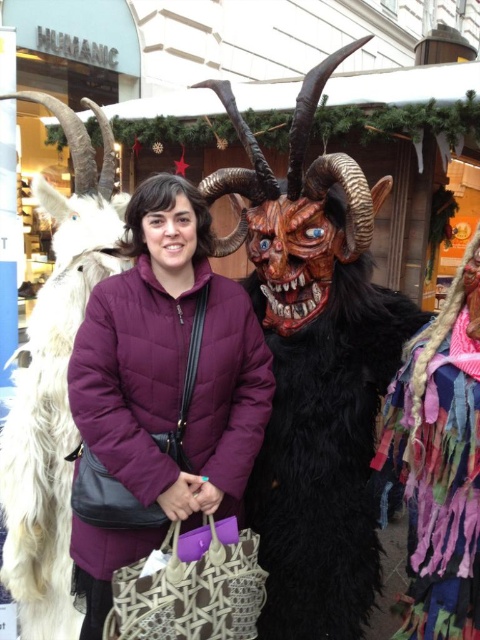
Is point (352, 372) positioned behind point (204, 292)?

Yes, point (352, 372) is behind point (204, 292).

Where is `wooden carved mask at center`? Image resolution: width=480 pixels, height=640 pixels. wooden carved mask at center is located at coordinates (314, 369).

Does point (372, 200) come farther from viewer compared to point (96, 224)?

No, it is in front of (96, 224).

Is the position of wooden carved mask at center more distant than that of white fur goat at left?

No, wooden carved mask at center is in front of white fur goat at left.

Does point (276, 486) come in front of point (20, 572)?

No, it is not.

The width and height of the screenshot is (480, 640). I want to click on wooden carved mask at center, so click(314, 369).

Can you confirm if purple quilted jacket at center is thinner than white fur goat at left?

No.

Who is higher up, purple quilted jacket at center or white fur goat at left?

white fur goat at left is higher up.

You are a GUI agent. You are given a task and a screenshot of the screen. Output one action in this format:
    pyautogui.click(x=<x>, y=<y>)
    Task: Click on the purple quilted jacket at center
    
    Given the screenshot: What is the action you would take?
    pyautogui.click(x=160, y=394)